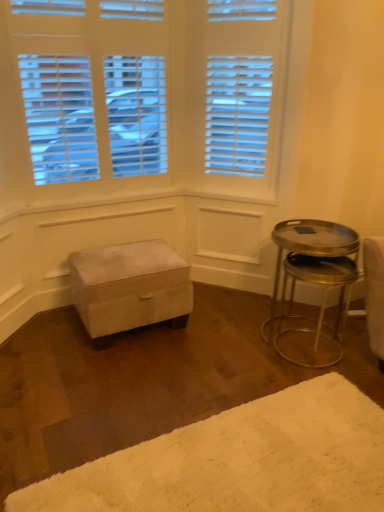
Identify the location of free space above velvet ottoman at center (from a real-world perspective). The width and height of the screenshot is (384, 512). (119, 260).